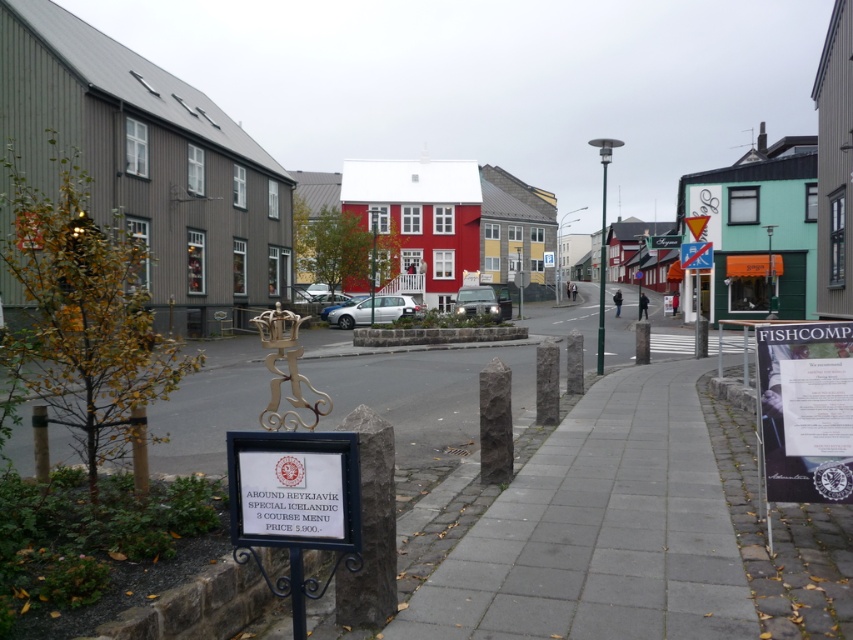
Question: Is wooden signpost at center thinner than white plastic sign at center?

Choices:
 (A) no
 (B) yes

Answer: (A)

Question: Is wooden signpost at center to the left of white plastic sign at center from the viewer's perspective?

Choices:
 (A) no
 (B) yes

Answer: (B)

Question: Which point is farther from the camera taking this photo?

Choices:
 (A) (596, 42)
 (B) (695, 268)

Answer: (A)

Question: Does wooden signpost at center appear on the right side of white plastic sign at center?

Choices:
 (A) yes
 (B) no

Answer: (B)